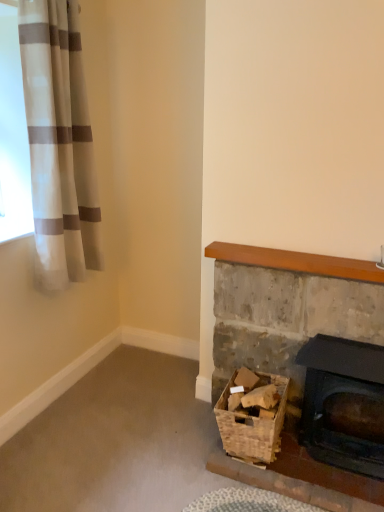
Locate an element on the screen. vacant area situated below matte black fireplace at lower right, the first fireplace in the right-to-left sequence (from a real-world perspective) is located at coordinates (326, 460).